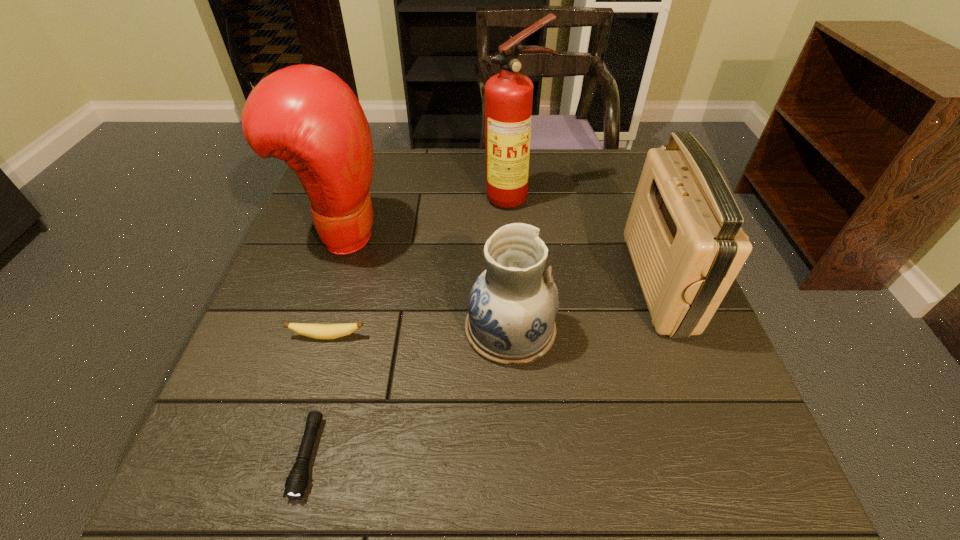
This screenshot has width=960, height=540. Find the location of `blank space located on the front-facing side of the fourth shortest object`. blank space located on the front-facing side of the fourth shortest object is located at coordinates (572, 282).

The width and height of the screenshot is (960, 540). In order to click on blank area located 0.390m on the front-facing side of the fourth shortest object in this screenshot , I will do `click(462, 282)`.

The width and height of the screenshot is (960, 540). In order to click on vacant space located on the front-facing side of the fourth shortest object in this screenshot , I will do `click(462, 282)`.

The image size is (960, 540). I want to click on free space located 0.120m on the back of the pottery, so click(506, 258).

Find the location of a particular element. This screenshot has width=960, height=540. vacant space located on the front of the fifth tallest object is located at coordinates (296, 445).

Locate an element on the screen. This screenshot has width=960, height=540. object that is positioned at the far edge is located at coordinates (508, 95).

Where is `object at the near edge`? This screenshot has width=960, height=540. object at the near edge is located at coordinates (297, 481).

Where is `boxing glove situated at the left edge`? boxing glove situated at the left edge is located at coordinates click(x=307, y=116).

Locate an element on the screen. This screenshot has width=960, height=540. banana that is at the left edge is located at coordinates (317, 331).

Find the location of a particular element. object located in the right edge section of the desktop is located at coordinates (683, 232).